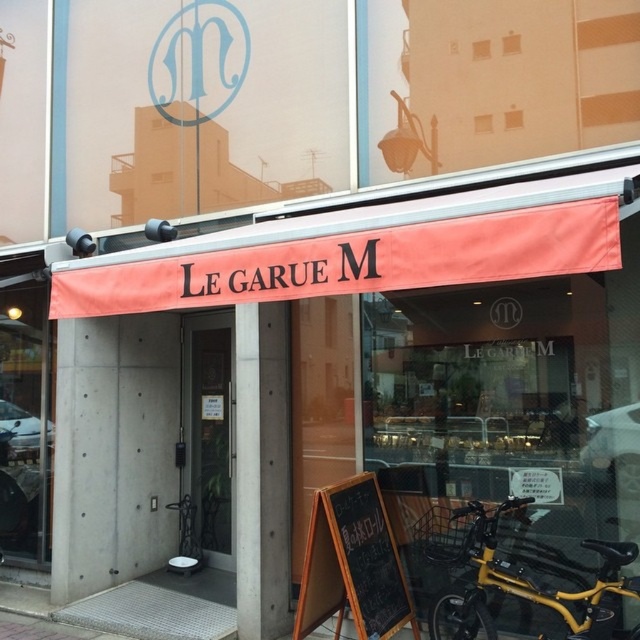
You are a delivery person trying to park your delivery van next to the yellow metallic bicycle at lower right and the black chalkboard at center. Which object should you move to make space for the van?

You should move the yellow metallic bicycle at lower right because it is larger in size than the black chalkboard at center, making it easier to relocate to free up space for the van.

You are a delivery person trying to deliver a package to the shop named LE GARUE M. The package is too large to fit through the door. You notice the orange fabric awning at center and the black chalkboard at center. Which object is wider, allowing you to place the package underneath it?

The orange fabric awning at center is wider than the black chalkboard at center, so you can place the package underneath the orange fabric awning at center.